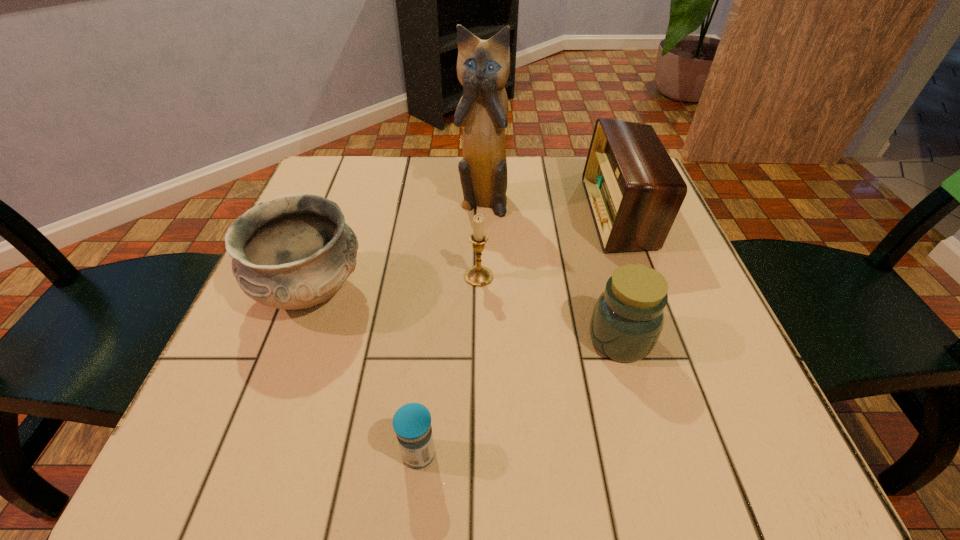
Where is `vacant area in the image that satisfies the following two spatial constraints: 1. on the front-facing side of the radio receiver; 2. on the front side of the medicine`? vacant area in the image that satisfies the following two spatial constraints: 1. on the front-facing side of the radio receiver; 2. on the front side of the medicine is located at coordinates (708, 454).

Identify the location of free region that satisfies the following two spatial constraints: 1. on the face of the jar; 2. on the left side of the cat. The image size is (960, 540). (x=483, y=339).